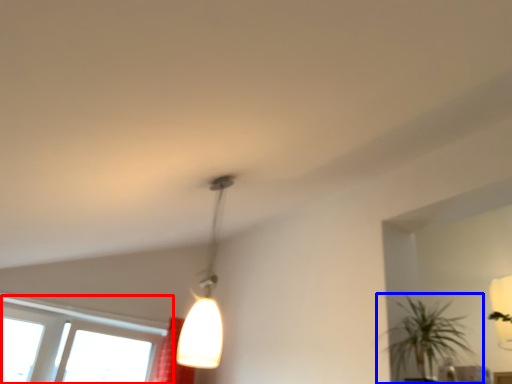
Question: Among these objects, which one is nearest to the camera, window (highlighted by a red box) or houseplant (highlighted by a blue box)?

Choices:
 (A) window
 (B) houseplant

Answer: (B)